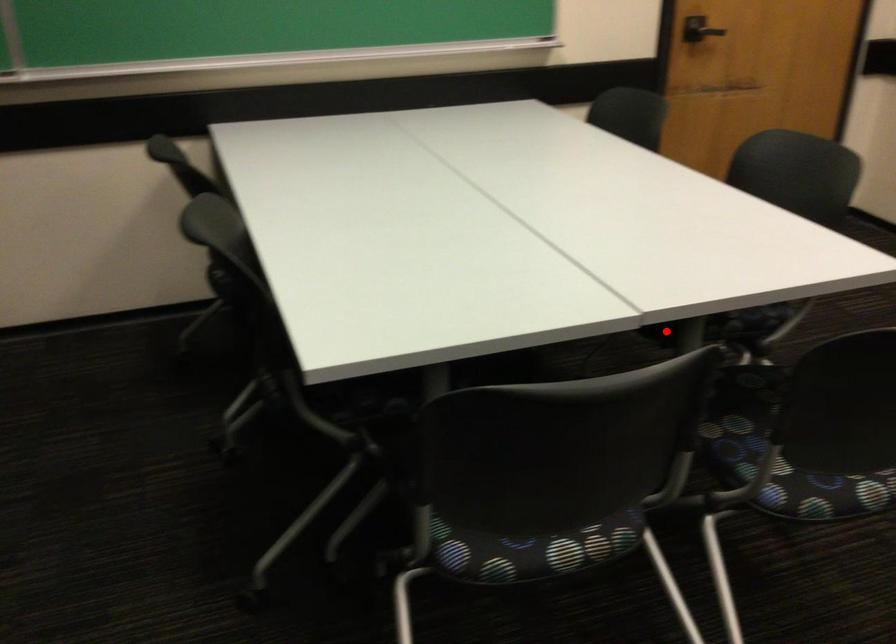
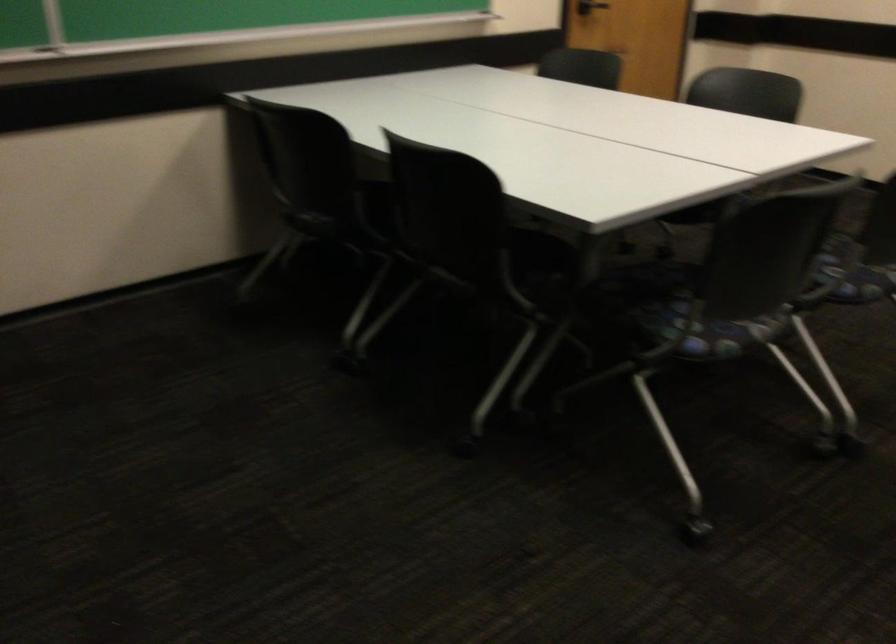
Question: I am providing you with two images of the same scene from different viewpoints. Given a red point in image1, look at the same physical point in image2. Is it:

Choices:
 (A) Closer to the viewpoint
 (B) Farther from the viewpoint

Answer: (B)